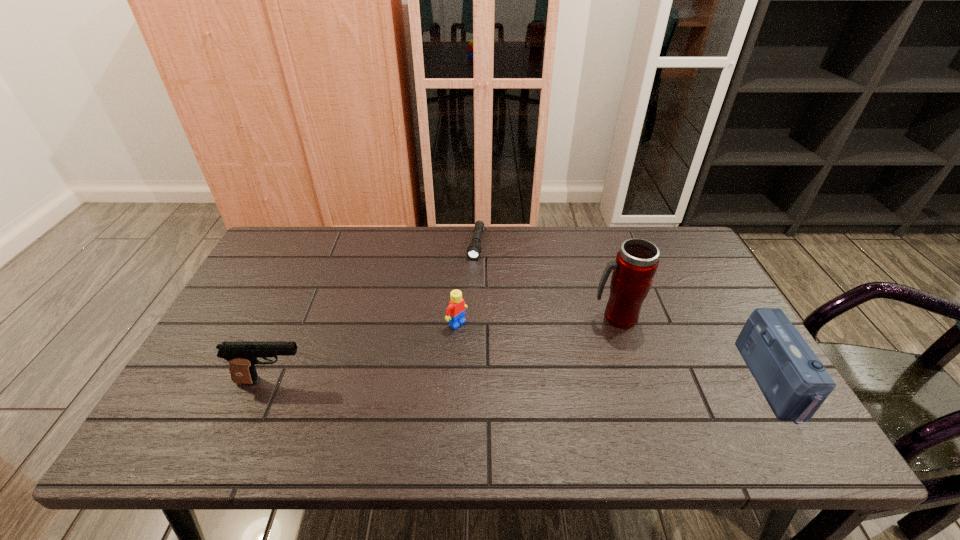
I want to click on free location that satisfies the following two spatial constraints: 1. on the back side of the flashlight; 2. on the left side of the Lego, so tap(461, 244).